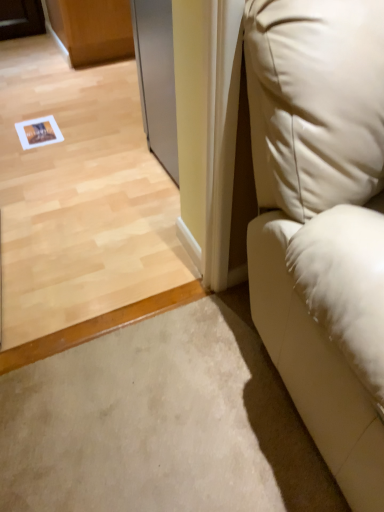
Image resolution: width=384 pixels, height=512 pixels. Describe the element at coordinates (157, 78) in the screenshot. I see `silver metallic screen door at upper center` at that location.

Where is `silver metallic screen door at upper center`? The width and height of the screenshot is (384, 512). silver metallic screen door at upper center is located at coordinates [x=157, y=78].

This screenshot has height=512, width=384. What do you see at coordinates (322, 222) in the screenshot?
I see `white leather couch at right` at bounding box center [322, 222].

The height and width of the screenshot is (512, 384). I want to click on white leather couch at right, so click(322, 222).

Identify the location of silver metallic screen door at upper center. The width and height of the screenshot is (384, 512). (157, 78).

Visually, is white leather couch at right positioned to the left or to the right of silver metallic screen door at upper center?

Clearly, white leather couch at right is on the right of silver metallic screen door at upper center in the image.

From the picture: Is white leather couch at right closer to camera compared to silver metallic screen door at upper center?

Yes, it is in front of silver metallic screen door at upper center.

Is point (320, 113) farther from viewer compared to point (162, 32)?

No.

From the image's perspective, between white leather couch at right and silver metallic screen door at upper center, who is located below?

white leather couch at right.

From a real-world perspective, which object stands above the other?

white leather couch at right is physically above.

In the scene shown: Does white leather couch at right have a greater width compared to silver metallic screen door at upper center?

Yes, white leather couch at right is wider than silver metallic screen door at upper center.

Considering the relative sizes of white leather couch at right and silver metallic screen door at upper center in the image provided, is white leather couch at right shorter than silver metallic screen door at upper center?

Incorrect, the height of white leather couch at right does not fall short of that of silver metallic screen door at upper center.

Does white leather couch at right have a larger size compared to silver metallic screen door at upper center?

Correct, white leather couch at right is larger in size than silver metallic screen door at upper center.

Is white leather couch at right located outside silver metallic screen door at upper center?

Absolutely, white leather couch at right is external to silver metallic screen door at upper center.

Is white leather couch at right not near silver metallic screen door at upper center?

white leather couch at right is near silver metallic screen door at upper center, not far away.

Does white leather couch at right turn towards silver metallic screen door at upper center?

No, white leather couch at right is not turned towards silver metallic screen door at upper center.

The height and width of the screenshot is (512, 384). In order to click on screen door directly beneath the white leather couch at right (from a real-world perspective) in this screenshot , I will do `click(157, 78)`.

From the picture: Which is more to the left, silver metallic screen door at upper center or white leather couch at right?

silver metallic screen door at upper center is more to the left.

Is silver metallic screen door at upper center positioned behind white leather couch at right?

That is True.

Considering the points (163, 67) and (352, 421), which point is in front, point (163, 67) or point (352, 421)?

The point (352, 421) is closer.

Based on the photo, from the image's perspective, is silver metallic screen door at upper center located above or below white leather couch at right?

Based on their image positions, silver metallic screen door at upper center is located above white leather couch at right.

From a real-world perspective, does silver metallic screen door at upper center sit lower than white leather couch at right?

Indeed, from a real-world perspective, silver metallic screen door at upper center is positioned beneath white leather couch at right.

Considering the relative sizes of silver metallic screen door at upper center and white leather couch at right in the image provided, is silver metallic screen door at upper center thinner than white leather couch at right?

Correct, the width of silver metallic screen door at upper center is less than that of white leather couch at right.

Who is shorter, silver metallic screen door at upper center or white leather couch at right?

silver metallic screen door at upper center.

Can you confirm if silver metallic screen door at upper center is bigger than white leather couch at right?

Incorrect, silver metallic screen door at upper center is not larger than white leather couch at right.

Can we say silver metallic screen door at upper center lies outside white leather couch at right?

silver metallic screen door at upper center lies outside white leather couch at right's area.

Would you consider silver metallic screen door at upper center to be distant from white leather couch at right?

They are positioned close to each other.

Is silver metallic screen door at upper center facing towards white leather couch at right?

No, silver metallic screen door at upper center is not facing towards white leather couch at right.

How different are the orientations of silver metallic screen door at upper center and white leather couch at right in degrees?

91.4 degrees separate the facing orientations of silver metallic screen door at upper center and white leather couch at right.

Locate an element on the screen. screen door behind the white leather couch at right is located at coordinates (157, 78).

Locate an element on the screen. This screenshot has width=384, height=512. furniture above the silver metallic screen door at upper center (from a real-world perspective) is located at coordinates (322, 222).

Where is `screen door behind the white leather couch at right`? This screenshot has width=384, height=512. screen door behind the white leather couch at right is located at coordinates (157, 78).